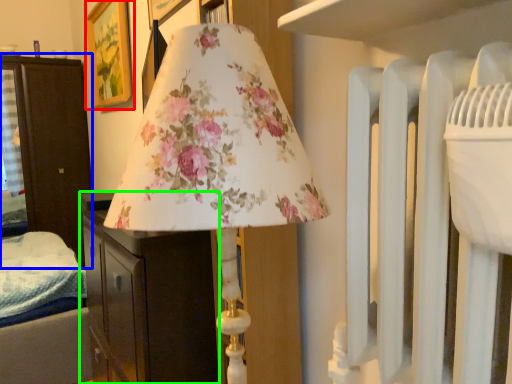
Question: Which object is positioned closest to picture frame (highlighted by a red box)? Select from furniture (highlighted by a blue box) and furniture (highlighted by a green box).

Choices:
 (A) furniture
 (B) furniture

Answer: (A)